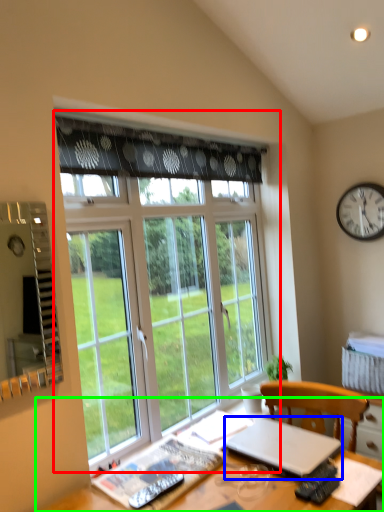
Question: Which is nearer to the window (highlighted by a red box)? laptop (highlighted by a blue box) or desk (highlighted by a green box).

Choices:
 (A) laptop
 (B) desk

Answer: (A)